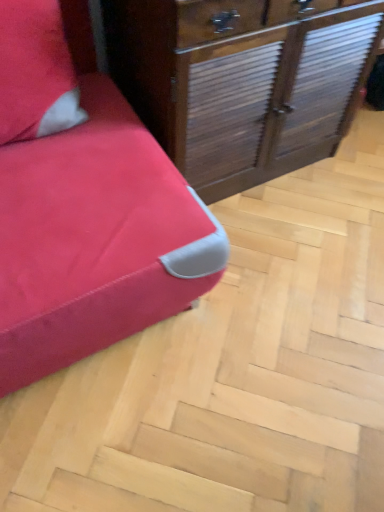
The width and height of the screenshot is (384, 512). What do you see at coordinates (243, 81) in the screenshot? I see `wooden with slats chest of drawers at center` at bounding box center [243, 81].

This screenshot has width=384, height=512. I want to click on wooden with slats chest of drawers at center, so click(x=243, y=81).

This screenshot has width=384, height=512. Describe the element at coordinates (86, 217) in the screenshot. I see `matte red sofa at left` at that location.

What is the approximate width of matte red sofa at left?

It is 35.49 inches.

Measure the distance between matte red sofa at left and camera.

matte red sofa at left is 32.29 inches away from camera.

The height and width of the screenshot is (512, 384). In order to click on matte red sofa at left in this screenshot , I will do `click(86, 217)`.

You are a GUI agent. You are given a task and a screenshot of the screen. Output one action in this format:
    pyautogui.click(x=<x>, y=<y>)
    Task: Click on the wooden with slats chest of drawers at center
    The width and height of the screenshot is (384, 512).
    Given the screenshot: What is the action you would take?
    pyautogui.click(x=243, y=81)

From the picture: Considering the relative positions of wooden with slats chest of drawers at center and matte red sofa at left in the image provided, is wooden with slats chest of drawers at center to the left or to the right of matte red sofa at left?

Based on their positions, wooden with slats chest of drawers at center is located to the right of matte red sofa at left.

Is the depth of wooden with slats chest of drawers at center greater than that of matte red sofa at left?

Yes, it is behind matte red sofa at left.

Is point (276, 32) more distant than point (24, 224)?

That is True.

From the image's perspective, which is above, wooden with slats chest of drawers at center or matte red sofa at left?

wooden with slats chest of drawers at center, from the image's perspective.

From a real-world perspective, is wooden with slats chest of drawers at center below matte red sofa at left?

No, from a real-world perspective, wooden with slats chest of drawers at center is not under matte red sofa at left.

Can you confirm if wooden with slats chest of drawers at center is wider than matte red sofa at left?

No, wooden with slats chest of drawers at center is not wider than matte red sofa at left.

Considering the relative sizes of wooden with slats chest of drawers at center and matte red sofa at left in the image provided, is wooden with slats chest of drawers at center shorter than matte red sofa at left?

No, wooden with slats chest of drawers at center is not shorter than matte red sofa at left.

Is wooden with slats chest of drawers at center bigger than matte red sofa at left?

Incorrect, wooden with slats chest of drawers at center is not larger than matte red sofa at left.

Is wooden with slats chest of drawers at center completely or partially outside of matte red sofa at left?

Indeed, wooden with slats chest of drawers at center is completely outside matte red sofa at left.

Is wooden with slats chest of drawers at center next to matte red sofa at left?

No, wooden with slats chest of drawers at center is not with matte red sofa at left.

Is matte red sofa at left at the back of wooden with slats chest of drawers at center?

No, matte red sofa at left is not at the back of wooden with slats chest of drawers at center.

How many degrees apart are the facing directions of wooden with slats chest of drawers at center and matte red sofa at left?

The angle between the facing direction of wooden with slats chest of drawers at center and the facing direction of matte red sofa at left is 0.871 degrees.

Measure the distance from wooden with slats chest of drawers at center to matte red sofa at left.

wooden with slats chest of drawers at center and matte red sofa at left are 15.53 inches apart from each other.

Locate an element on the screen. furniture that appears below the wooden with slats chest of drawers at center (from the image's perspective) is located at coordinates (86, 217).

Is matte red sofa at left to the right of wooden with slats chest of drawers at center from the viewer's perspective?

Incorrect, matte red sofa at left is not on the right side of wooden with slats chest of drawers at center.

Is matte red sofa at left positioned before wooden with slats chest of drawers at center?

Yes, matte red sofa at left is in front of wooden with slats chest of drawers at center.

Considering the positions of point (45, 146) and point (246, 41), is point (45, 146) closer or farther from the camera than point (246, 41)?

Clearly, point (45, 146) is more distant from the camera than point (246, 41).

From the image's perspective, is matte red sofa at left above wooden with slats chest of drawers at center?

No, from the image's perspective, matte red sofa at left is not over wooden with slats chest of drawers at center.

From a real-world perspective, is matte red sofa at left located beneath wooden with slats chest of drawers at center?

Yes, from a real-world perspective, matte red sofa at left is beneath wooden with slats chest of drawers at center.

Considering the relative sizes of matte red sofa at left and wooden with slats chest of drawers at center in the image provided, is matte red sofa at left wider than wooden with slats chest of drawers at center?

Indeed, matte red sofa at left has a greater width compared to wooden with slats chest of drawers at center.

Is matte red sofa at left taller than wooden with slats chest of drawers at center?

No, matte red sofa at left is not taller than wooden with slats chest of drawers at center.

Between matte red sofa at left and wooden with slats chest of drawers at center, which one has larger size?

Bigger between the two is matte red sofa at left.

Is matte red sofa at left completely or partially outside of wooden with slats chest of drawers at center?

That's correct, matte red sofa at left is outside of wooden with slats chest of drawers at center.

Is matte red sofa at left touching wooden with slats chest of drawers at center?

No, matte red sofa at left is not touching wooden with slats chest of drawers at center.

Is matte red sofa at left facing away from wooden with slats chest of drawers at center?

matte red sofa at left is not turned away from wooden with slats chest of drawers at center.

Measure the distance from matte red sofa at left to wooden with slats chest of drawers at center.

matte red sofa at left and wooden with slats chest of drawers at center are 15.53 inches apart.

Where is `the chest of drawers that appears above the matte red sofa at left (from a real-world perspective)`? the chest of drawers that appears above the matte red sofa at left (from a real-world perspective) is located at coordinates (243, 81).

Locate an element on the screen. The height and width of the screenshot is (512, 384). furniture to the left of wooden with slats chest of drawers at center is located at coordinates (86, 217).

This screenshot has width=384, height=512. I want to click on the chest of drawers lying behind the matte red sofa at left, so click(243, 81).